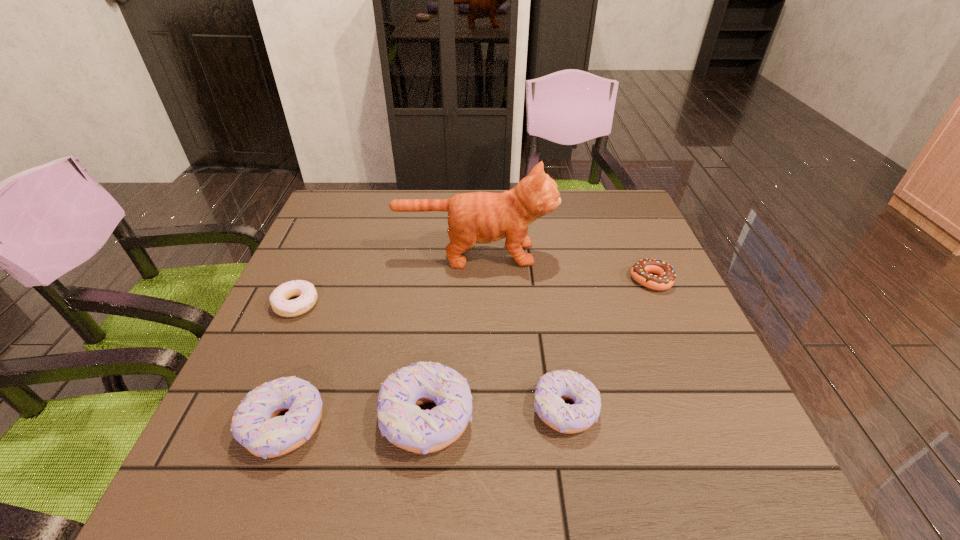
Locate an element on the screen. doughnut that is the third nearest to the third doughnut from right to left is located at coordinates (279, 299).

Select which doughnut appears as the fifth closest to the cat. Please provide its 2D coordinates. Your answer should be formatted as a tuple, i.e. [(x, y)], where the tuple contains the x and y coordinates of a point satisfying the conditions above.

[(256, 425)]

Identify the location of vacant region that satisfies the following two spatial constraints: 1. on the face of the tallest object; 2. on the front side of the third doughnut from right to left. (472, 417).

The height and width of the screenshot is (540, 960). Find the location of `blank space that satisfies the following two spatial constraints: 1. on the back side of the fourth doughnut from left to right; 2. on the right side of the third doughnut from right to left`. blank space that satisfies the following two spatial constraints: 1. on the back side of the fourth doughnut from left to right; 2. on the right side of the third doughnut from right to left is located at coordinates (428, 409).

The height and width of the screenshot is (540, 960). I want to click on vacant area that satisfies the following two spatial constraints: 1. on the back side of the rightmost object; 2. on the face of the tallest object, so click(639, 254).

Identify the location of free location that satisfies the following two spatial constraints: 1. on the face of the third shortest object; 2. on the right side of the cat. (472, 409).